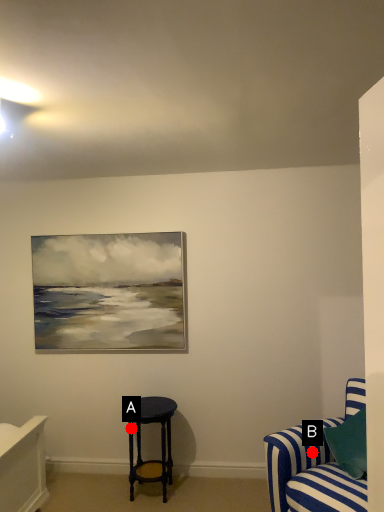
Question: Two points are circled on the image, labeled by A and B beside each circle. Which point is farther to the camera?

Choices:
 (A) A is further
 (B) B is further

Answer: (A)